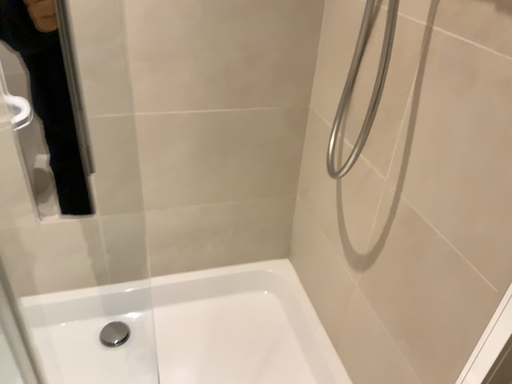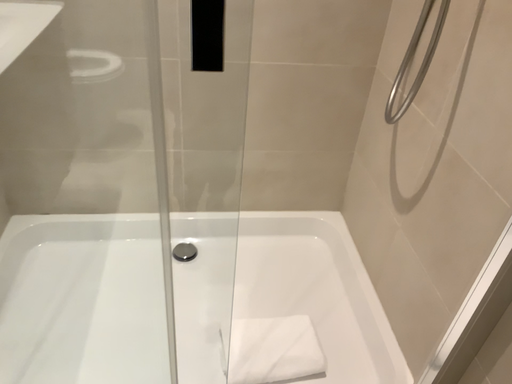
Question: Which way did the camera rotate in the video?

Choices:
 (A) rotated right
 (B) rotated left

Answer: (B)